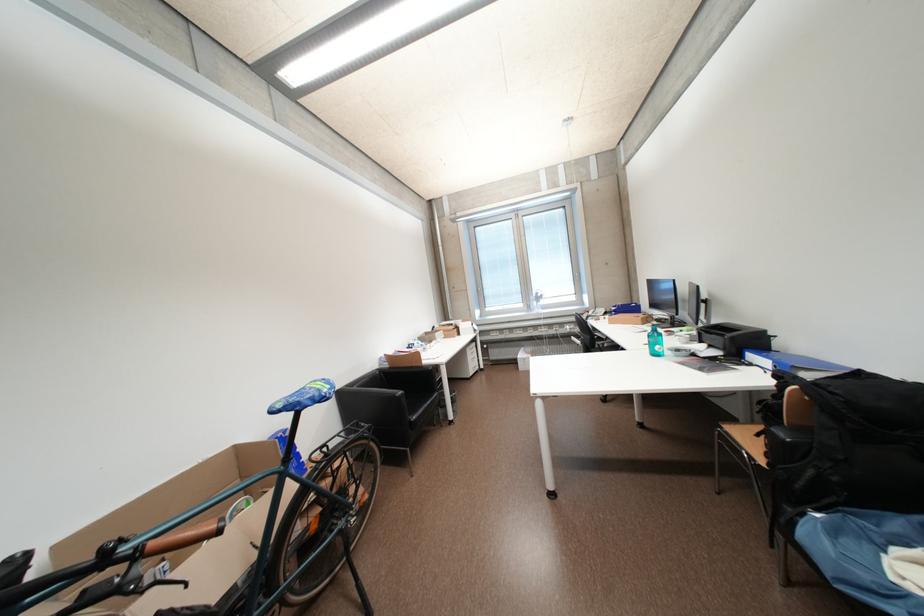
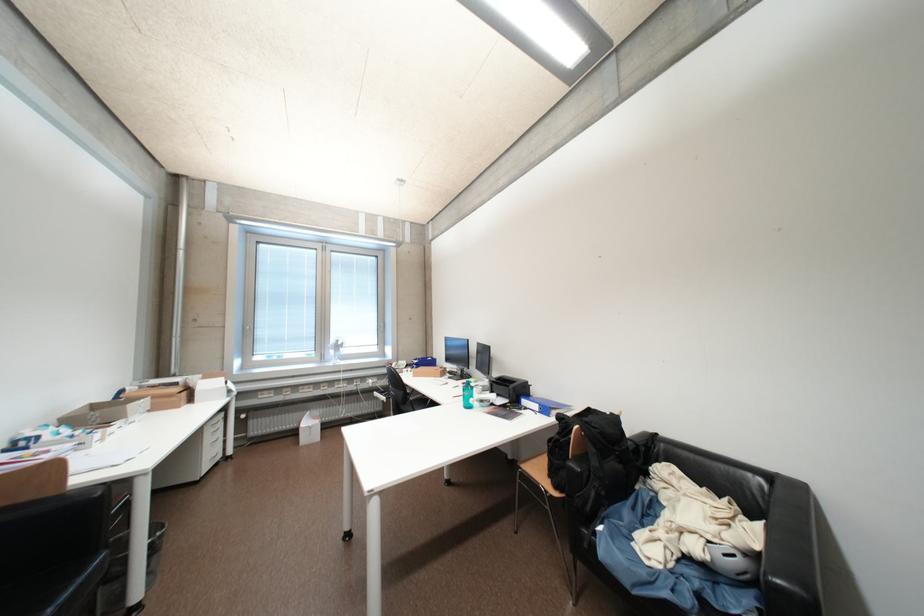
The point at (x=464, y=331) is marked in the first image. Where is the corresponding point in the second image?

(192, 395)